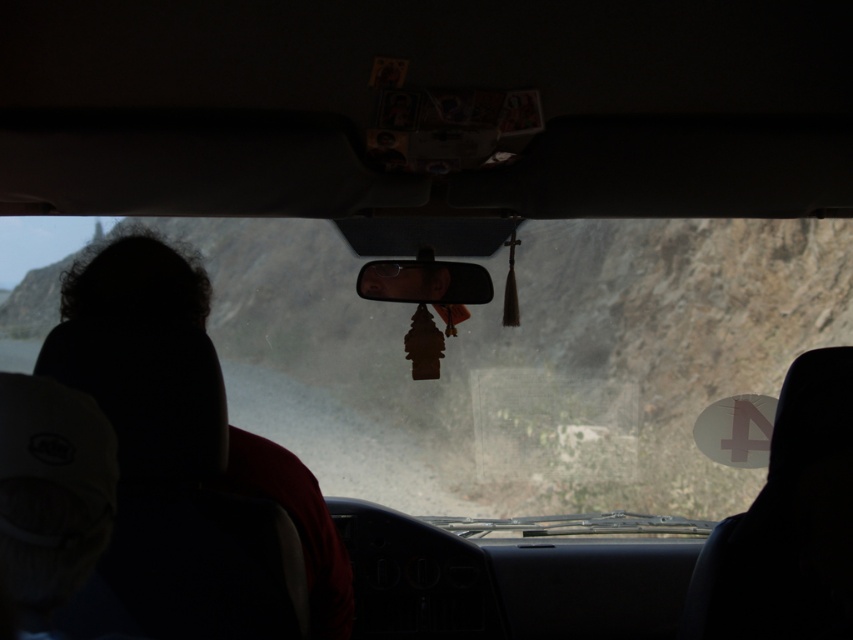
Question: Which is nearer to the glossy plastic view mirror at center?

Choices:
 (A) dark hair at left
 (B) transparent glass windshield at center

Answer: (A)

Question: Which of the following is the farthest from the observer?

Choices:
 (A) glossy plastic view mirror at center
 (B) transparent glass windshield at center
 (C) dark hair at left

Answer: (B)

Question: Can you confirm if transparent glass windshield at center is positioned below dark hair at left?

Choices:
 (A) no
 (B) yes

Answer: (B)

Question: Which point appears closest to the camera in this image?

Choices:
 (A) (344, 308)
 (B) (96, 273)

Answer: (B)

Question: Does dark hair at left have a greater width compared to glossy plastic view mirror at center?

Choices:
 (A) no
 (B) yes

Answer: (B)

Question: Does dark hair at left appear on the left side of glossy plastic view mirror at center?

Choices:
 (A) no
 (B) yes

Answer: (B)